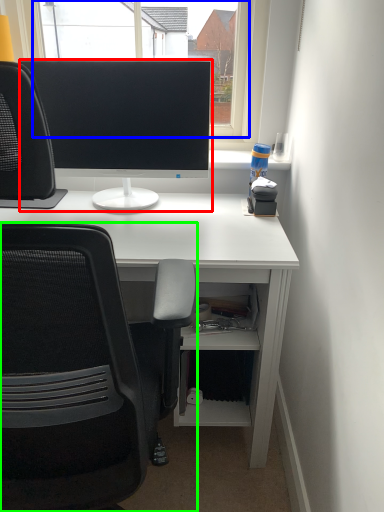
Question: Estimate the real-world distances between objects in this image. Which object is closer to computer monitor (highlighted by a red box), window screen (highlighted by a blue box) or chair (highlighted by a green box)?

Choices:
 (A) window screen
 (B) chair

Answer: (A)